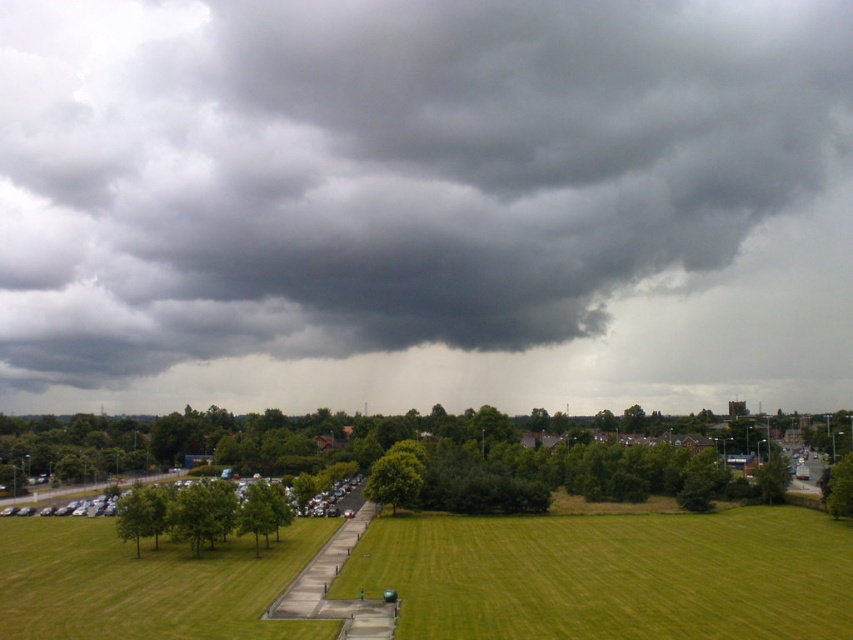
You are standing at the lower left corner of the image and want to walk towards the green grassy field at center. Which direction should you move relative to the green grass at lower left?

You should move to the right relative to the green grass at lower left because the green grassy field at center is located to the right of it.

You are planning to set up a picnic blanket in the green grassy field at center. Considering the dark gray cloud at upper center, what should you be cautious about?

The dark gray cloud at upper center is larger than the green grassy field at center, which might indicate an approaching storm, so you should be cautious about sudden rain or bad weather.

You are a photographer planning to take a landscape photo of the dark gray cloud at upper center and the green grassy field at center. Which object will appear closer to the camera in the photo?

The dark gray cloud at upper center will appear closer to the camera in the photo because the green grassy field at center is behind it.